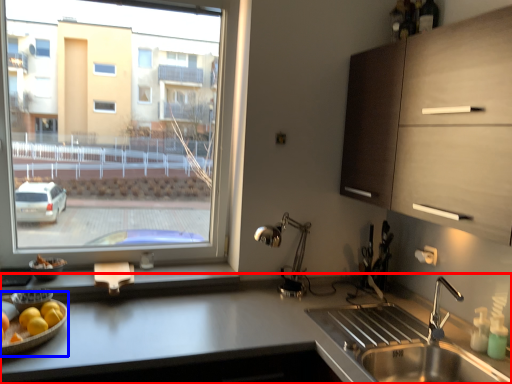
Question: Which of the following is the closest to the observer, countertop (highlighted by a red box) or fruit dish (highlighted by a blue box)?

Choices:
 (A) countertop
 (B) fruit dish

Answer: (A)